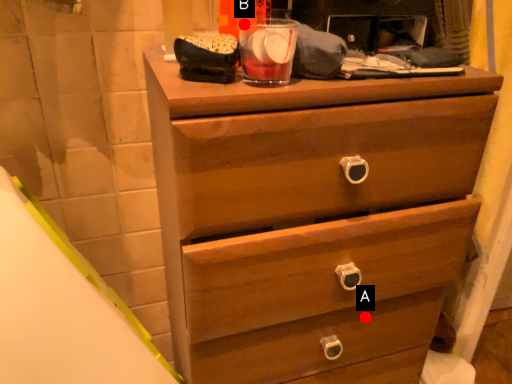
Question: Two points are circled on the image, labeled by A and B beside each circle. Which of the following is the farthest from the observer?

Choices:
 (A) A is further
 (B) B is further

Answer: (A)